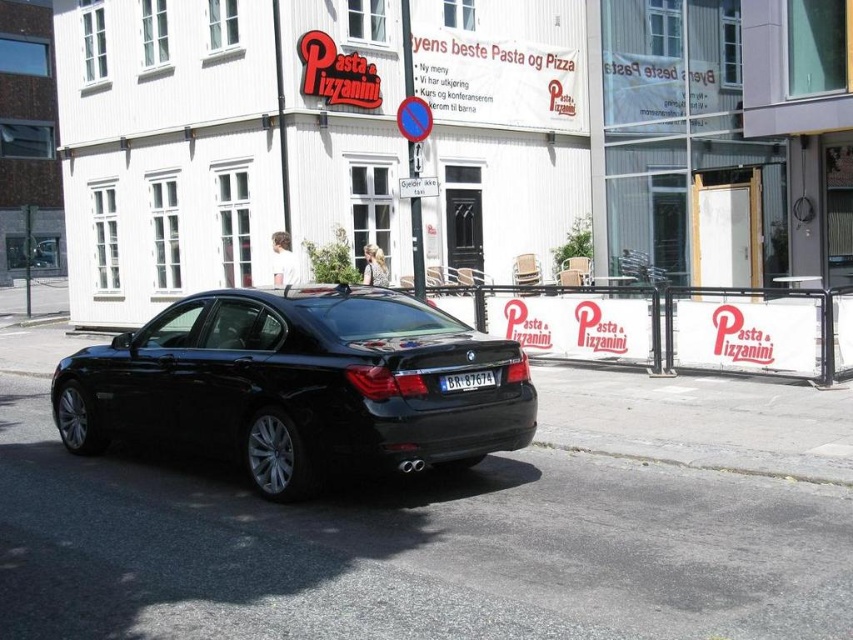
Based on the photo, between black metallic car at center and white plastic barrier at center, which one has more height?

Standing taller between the two is black metallic car at center.

Looking at this image, which is below, black metallic car at center or white plastic barrier at center?

black metallic car at center is below.

You are a GUI agent. You are given a task and a screenshot of the screen. Output one action in this format:
    pyautogui.click(x=<x>, y=<y>)
    Task: Click on the black metallic car at center
    
    Given the screenshot: What is the action you would take?
    pyautogui.click(x=299, y=385)

The image size is (853, 640). What are the coordinates of `black metallic car at center` in the screenshot? It's located at (299, 385).

Who is shorter, white plastic barrier at center or black plastic license plate at center?

Standing shorter between the two is black plastic license plate at center.

Does point (558, 339) come in front of point (444, 378)?

No, it is behind (444, 378).

You are a GUI agent. You are given a task and a screenshot of the screen. Output one action in this format:
    pyautogui.click(x=<x>, y=<y>)
    Task: Click on the white plastic barrier at center
    This screenshot has height=640, width=853.
    Given the screenshot: What is the action you would take?
    pyautogui.click(x=670, y=328)

Which is above, black metallic car at center or black plastic license plate at center?

black plastic license plate at center is higher up.

Where is `black metallic car at center`? The width and height of the screenshot is (853, 640). black metallic car at center is located at coordinates (299, 385).

Is point (260, 456) positioned after point (477, 384)?

Yes, point (260, 456) is behind point (477, 384).

Find the location of a particular element. This screenshot has width=853, height=640. black metallic car at center is located at coordinates (299, 385).